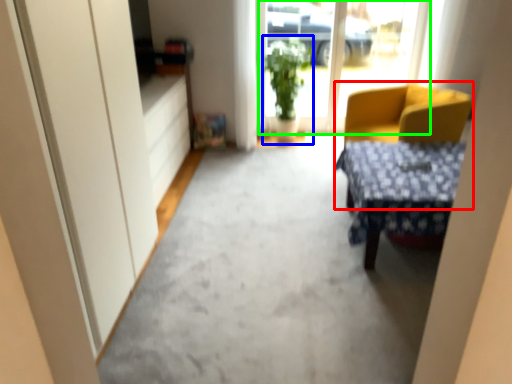
Question: Which is nearer to the chair (highlighted by a red box)? houseplant (highlighted by a blue box) or window screen (highlighted by a green box).

Choices:
 (A) houseplant
 (B) window screen

Answer: (A)